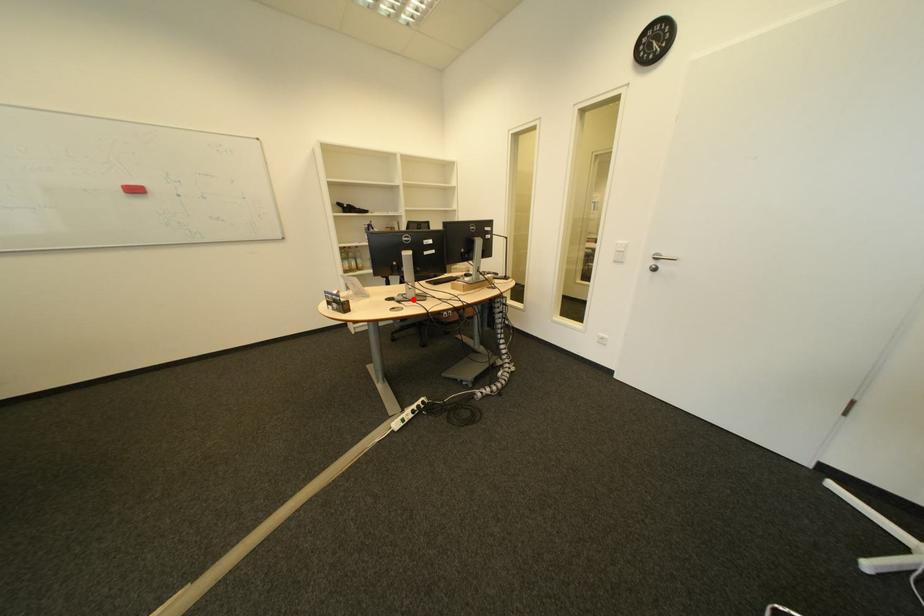
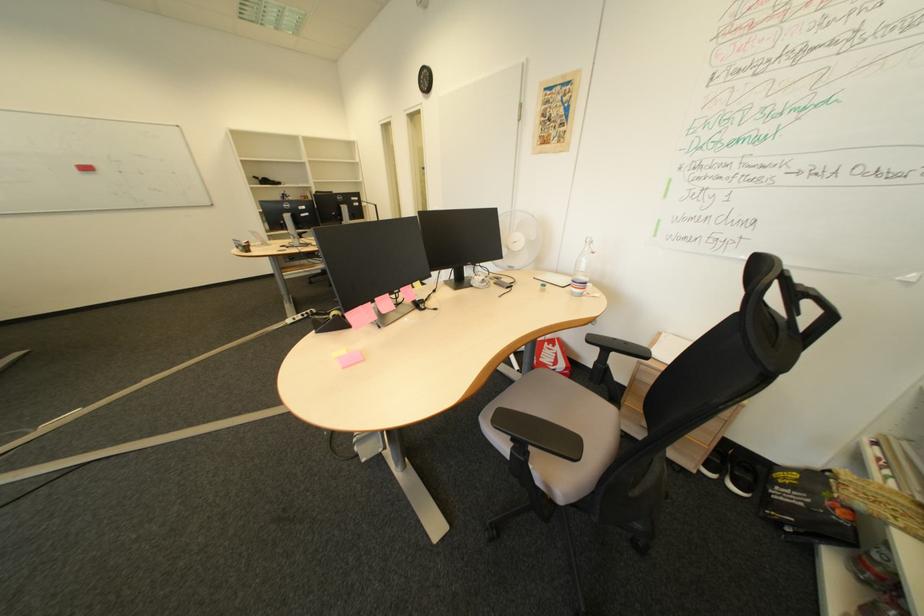
Question: I am providing you with two images of the same scene from different viewpoints. A red point is marked on the first image. Is the red point's position out of view in image 2?

Choices:
 (A) Yes
 (B) No

Answer: (B)